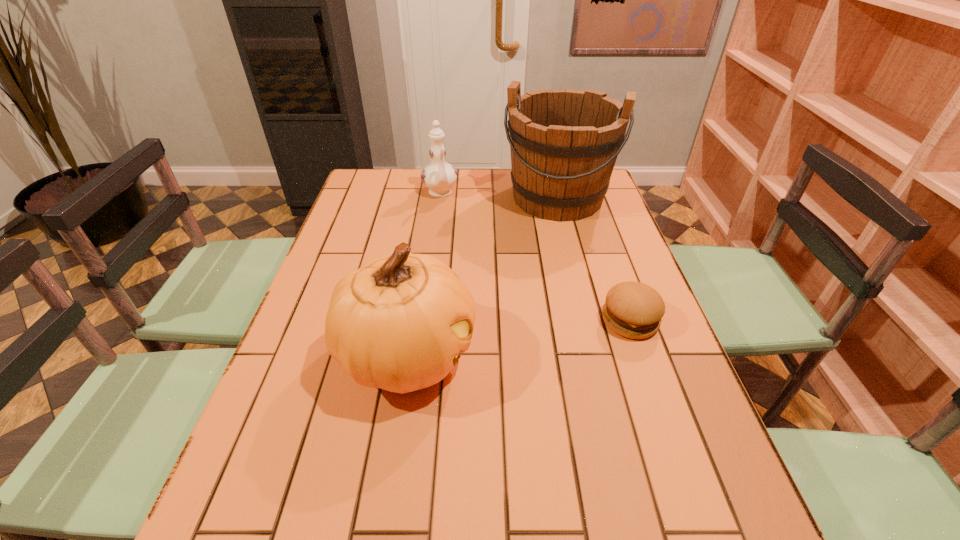
You are a GUI agent. You are given a task and a screenshot of the screen. Output one action in this format:
    pyautogui.click(x=<x>, y=<y>)
    Task: Click on the free space on the desktop that is between the pumpkin and the shortest object and is positioned at the spout of the chinaware
    The height and width of the screenshot is (540, 960).
    Given the screenshot: What is the action you would take?
    pyautogui.click(x=497, y=341)

Identify the location of free spot on the desktop that is between the pumpkin and the shortest object and is positioned on the side of the wine bucket with the handle for carrying. pos(512,338).